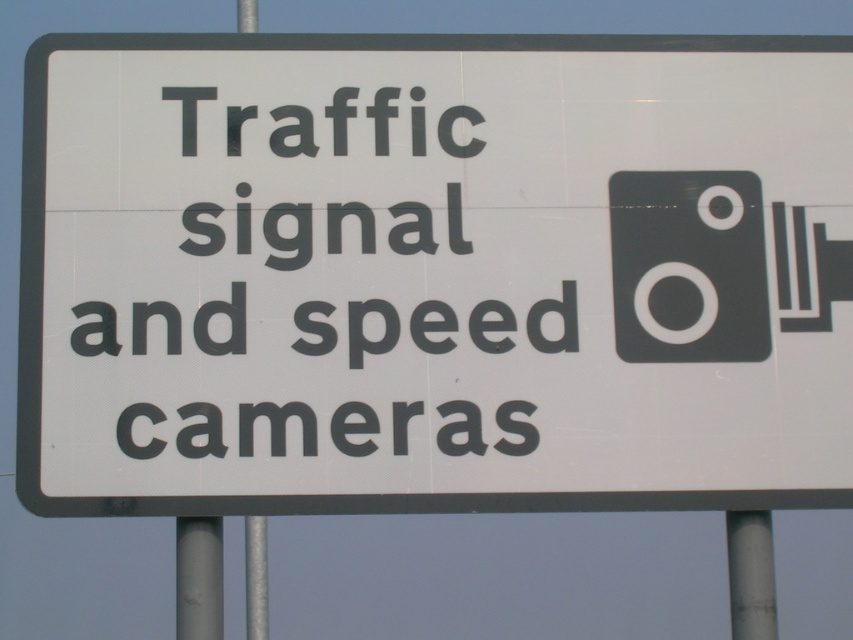
You are a delivery driver who needs to locate the traffic sign with the camera icon. According to the image, where is the point at coordinates (434, 273) located?

The point at coordinates (434, 273) is located on the white plastic sign at center, which is the traffic sign with the camera icon mentioned in the scene.

What is the position of the black plastic text at center on the traffic sign?

The black plastic text at center is located at point (316, 285).